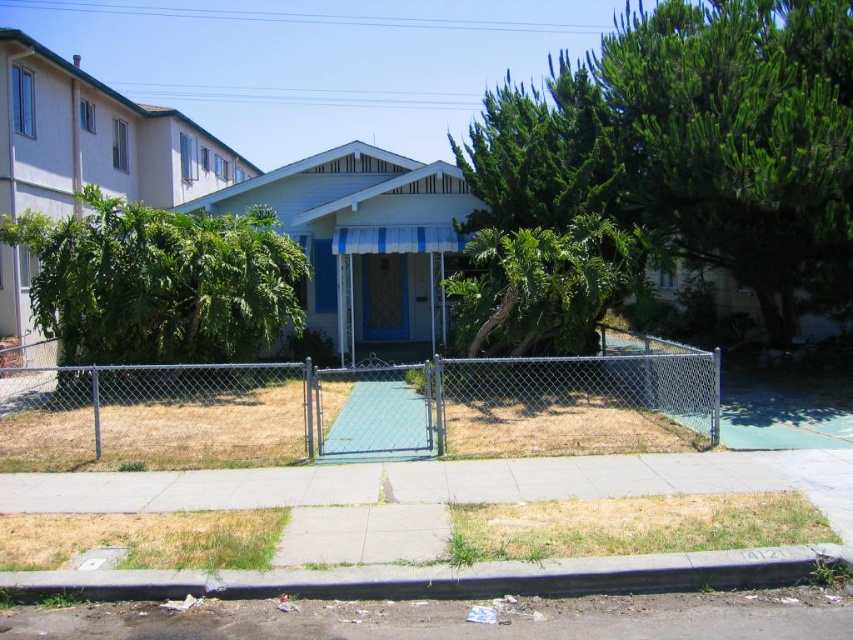
Find the location of `chain link fence at center`. chain link fence at center is located at coordinates (360, 408).

Can you confirm if chain link fence at center is wider than gray concrete curb at lower center?

Yes, chain link fence at center is wider than gray concrete curb at lower center.

Where is `chain link fence at center`? chain link fence at center is located at coordinates (360, 408).